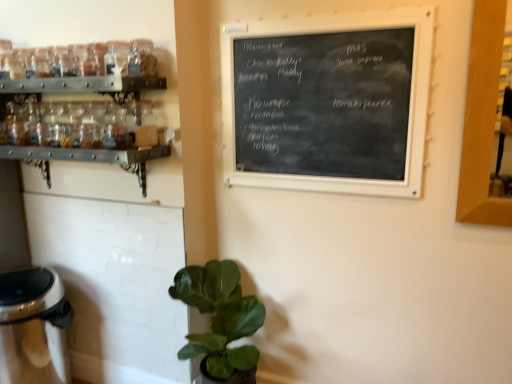
Question: Is satin silver trash can at lower left wider or thinner than black chalkboard at upper center?

Choices:
 (A) wide
 (B) thin

Answer: (A)

Question: Would you say satin silver trash can at lower left is inside or outside black chalkboard at upper center?

Choices:
 (A) outside
 (B) inside

Answer: (A)

Question: Which is farther from the clear glass jars at upper left?

Choices:
 (A) satin silver trash can at lower left
 (B) green matte plant at lower center
 (C) black chalkboard at upper center

Answer: (A)

Question: Which is nearer to the satin silver trash can at lower left?

Choices:
 (A) green matte plant at lower center
 (B) clear glass jars at upper left
 (C) black chalkboard at upper center

Answer: (A)